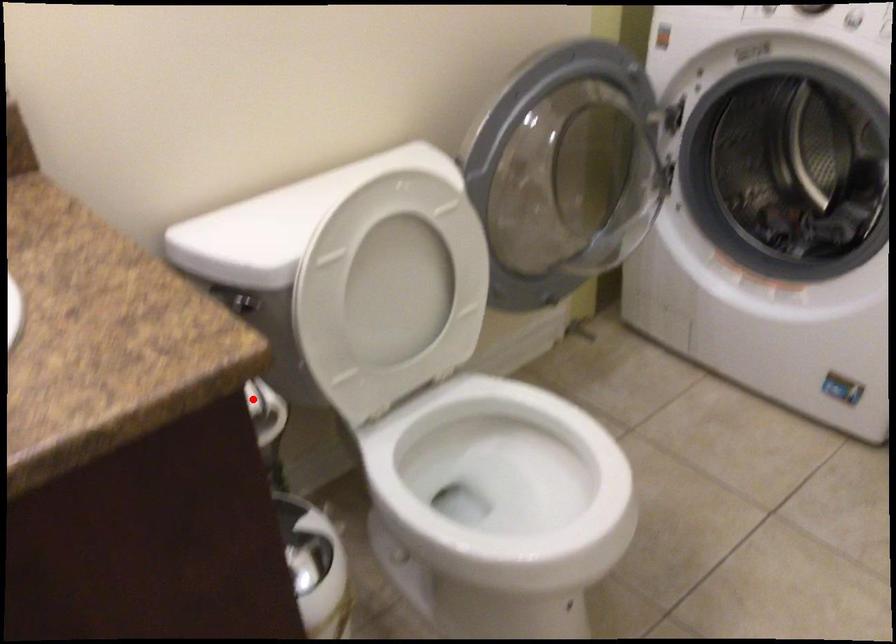
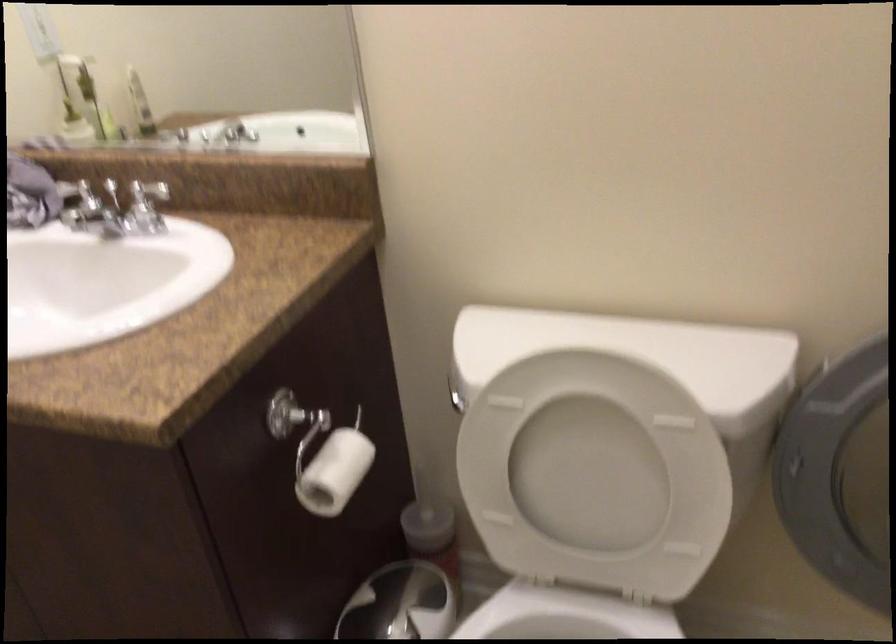
Question: I am providing you with two images of the same scene from different viewpoints. Given a red point in image1, look at the same physical point in image2. Is it:

Choices:
 (A) Closer to the viewpoint
 (B) Farther from the viewpoint

Answer: (B)